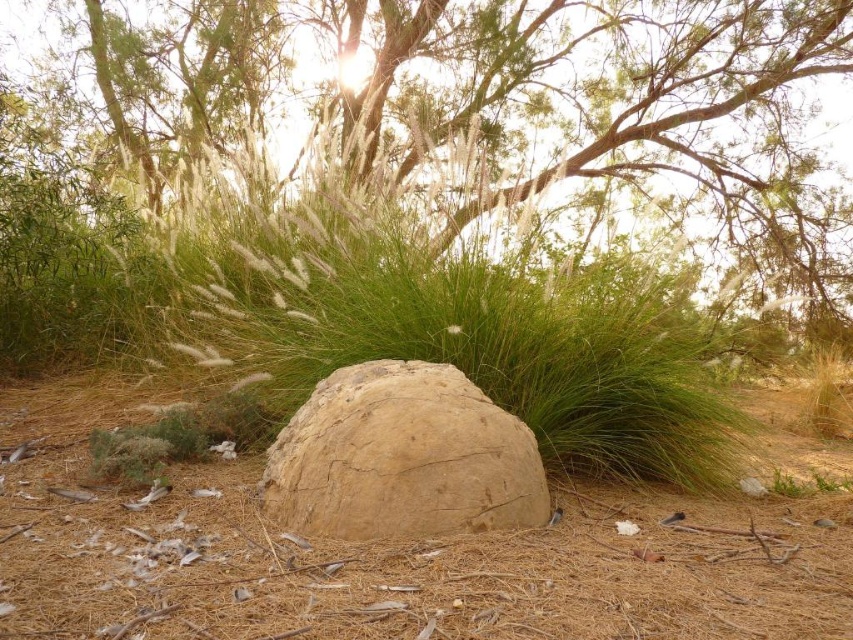
Is green leafy tree at upper center positioned behind green grass at center?

No.

Does green leafy tree at upper center appear on the right side of green grass at center?

Yes, green leafy tree at upper center is to the right of green grass at center.

Is point (102, 256) positioned behind point (397, 248)?

That is True.

I want to click on green leafy tree at upper center, so click(426, 122).

Does green grass at center have a larger size compared to brown rough boulder at center?

Incorrect, green grass at center is not larger than brown rough boulder at center.

Is point (637, 268) positioned before point (518, 426)?

That is False.

This screenshot has width=853, height=640. Identify the location of green grass at center. (393, 326).

Looking at this image, can you confirm if green leafy tree at upper center is wider than brown rough boulder at center?

Indeed, green leafy tree at upper center has a greater width compared to brown rough boulder at center.

Can you confirm if green leafy tree at upper center is shorter than brown rough boulder at center?

In fact, green leafy tree at upper center may be taller than brown rough boulder at center.

The width and height of the screenshot is (853, 640). In order to click on green leafy tree at upper center in this screenshot , I will do `click(426, 122)`.